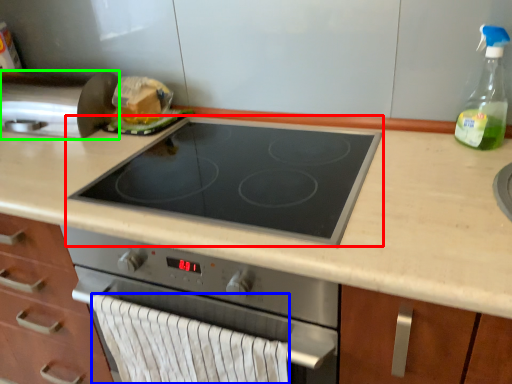
Question: Estimate the real-world distances between objects in this image. Which object is closer to gas stove (highlighted by a red box), hand towel (highlighted by a blue box) or kitchen appliance (highlighted by a green box)?

Choices:
 (A) hand towel
 (B) kitchen appliance

Answer: (A)